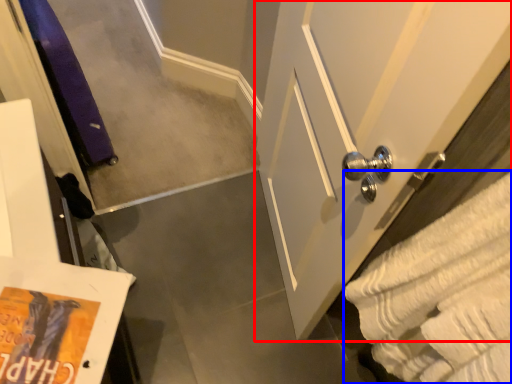
Question: Which object appears closest to the camera in this image, door (highlighted by a red box) or bath towel (highlighted by a blue box)?

Choices:
 (A) door
 (B) bath towel

Answer: (B)